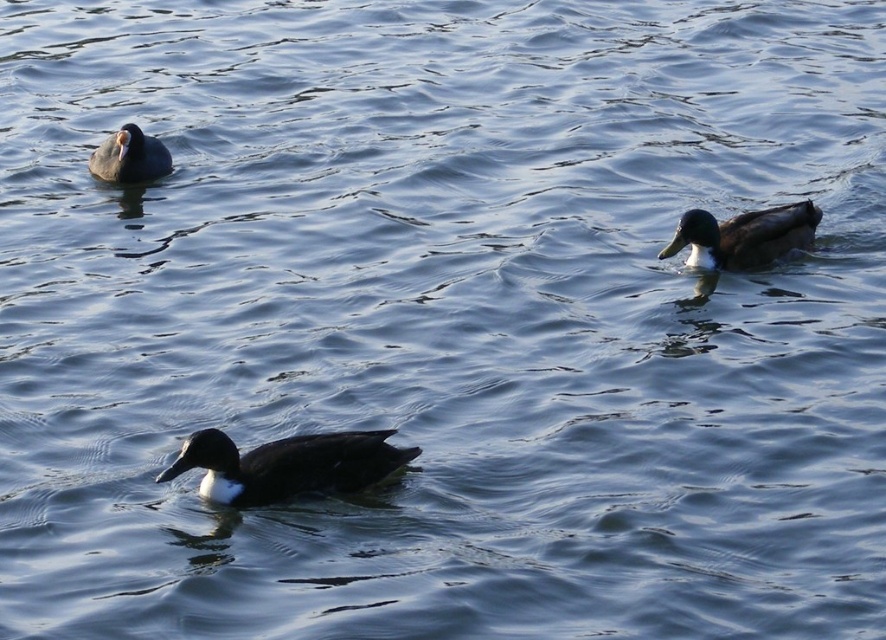
Question: Among these objects, which one is farthest from the camera?

Choices:
 (A) dark brown glossy duck at center
 (B) shiny brown duck at upper right
 (C) dark blue feathers at upper left

Answer: (C)

Question: Which of these objects is positioned farthest from the shiny brown duck at upper right?

Choices:
 (A) dark brown glossy duck at center
 (B) dark blue feathers at upper left

Answer: (B)

Question: Does shiny brown duck at upper right appear on the right side of dark blue feathers at upper left?

Choices:
 (A) yes
 (B) no

Answer: (A)

Question: Is dark brown glossy duck at center smaller than shiny brown duck at upper right?

Choices:
 (A) no
 (B) yes

Answer: (B)

Question: Is shiny brown duck at upper right to the right of dark blue feathers at upper left from the viewer's perspective?

Choices:
 (A) yes
 (B) no

Answer: (A)

Question: Which point is farther to the camera?

Choices:
 (A) dark brown glossy duck at center
 (B) shiny brown duck at upper right
 (C) dark blue feathers at upper left

Answer: (C)